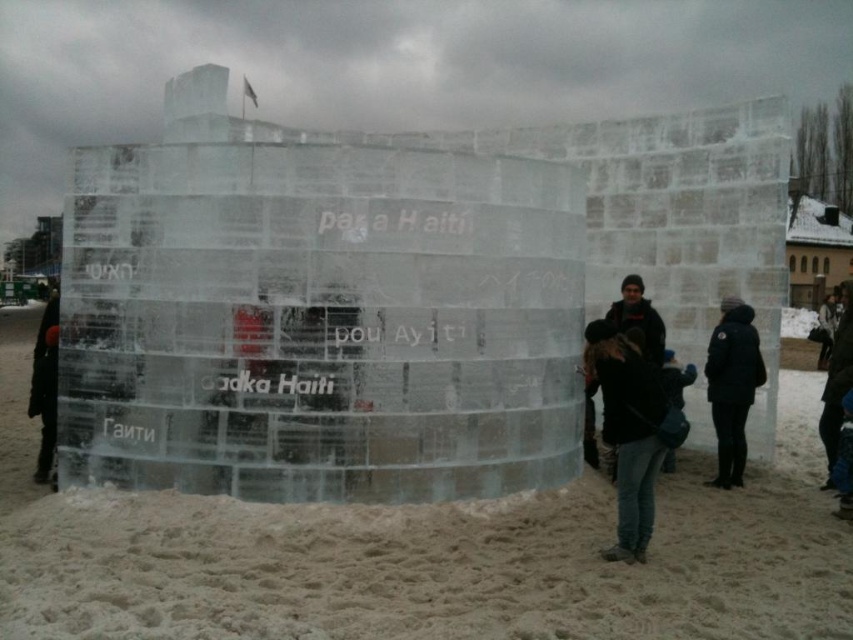
Looking at this image, does white sand at lower center have a greater width compared to black matte jacket at right?

Yes, white sand at lower center is wider than black matte jacket at right.

Is point (546, 582) farther from viewer compared to point (714, 365)?

No, (546, 582) is closer to viewer.

At what (x,y) coordinates should I click in order to perform the action: click on white sand at lower center. Please return your answer as a coordinate pair (x, y). The width and height of the screenshot is (853, 640). Looking at the image, I should click on (415, 556).

Can you confirm if white sand at lower center is positioned to the left of dark blue jeans at lower right?

Indeed, white sand at lower center is positioned on the left side of dark blue jeans at lower right.

Is white sand at lower center smaller than dark blue jeans at lower right?

Actually, white sand at lower center might be larger than dark blue jeans at lower right.

Between point (485, 506) and point (630, 547), which one is positioned in front?

Point (630, 547)

The height and width of the screenshot is (640, 853). I want to click on white sand at lower center, so click(415, 556).

Between dark blue jeans at lower right and black matte jacket at right, which one appears on the right side from the viewer's perspective?

From the viewer's perspective, black matte jacket at right appears more on the right side.

Does dark blue jeans at lower right have a lesser width compared to black matte jacket at right?

No.

You are a GUI agent. You are given a task and a screenshot of the screen. Output one action in this format:
    pyautogui.click(x=<x>, y=<y>)
    Task: Click on the dark blue jeans at lower right
    The height and width of the screenshot is (640, 853).
    Given the screenshot: What is the action you would take?
    pyautogui.click(x=631, y=432)

The image size is (853, 640). Find the location of `dark blue jeans at lower right`. dark blue jeans at lower right is located at coordinates (631, 432).